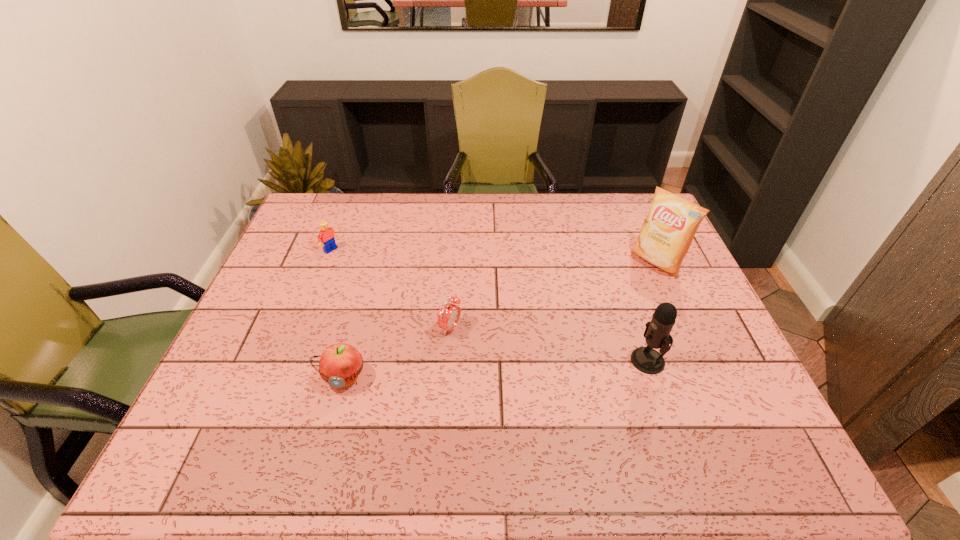
Locate an element on the screen. This screenshot has height=540, width=960. vacant area located 0.170m on the face of the third object from left to right is located at coordinates (518, 360).

Where is `free location located on the front-facing side of the leftmost object`? The height and width of the screenshot is (540, 960). free location located on the front-facing side of the leftmost object is located at coordinates (420, 306).

Identify the location of free region located 0.260m on the front-facing side of the leftmost object. This screenshot has width=960, height=540. (393, 289).

Where is `free space located on the front-facing side of the leftmost object`? free space located on the front-facing side of the leftmost object is located at coordinates (424, 309).

This screenshot has width=960, height=540. Identify the location of free space located on the front-facing side of the rightmost object. (621, 289).

Where is `vacant space positioned on the front-facing side of the rightmost object`? The height and width of the screenshot is (540, 960). vacant space positioned on the front-facing side of the rightmost object is located at coordinates (607, 300).

Where is `vacant space located 0.340m on the front-facing side of the rightmost object`? The image size is (960, 540). vacant space located 0.340m on the front-facing side of the rightmost object is located at coordinates coord(569,328).

Image resolution: width=960 pixels, height=540 pixels. I want to click on object located at the near edge, so click(340, 364).

This screenshot has height=540, width=960. In order to click on object located in the left edge section of the desktop in this screenshot , I will do `click(327, 234)`.

At what (x,y) coordinates should I click in order to perform the action: click on object that is at the right edge. Please return your answer as a coordinate pair (x, y). This screenshot has height=540, width=960. Looking at the image, I should click on (667, 233).